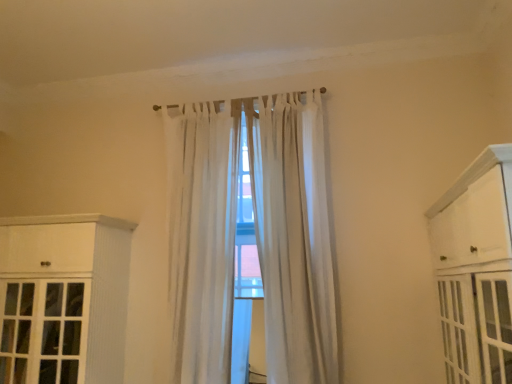
Question: From a real-world perspective, is white sheer curtain at center, which ranks as the 2th curtain in right-to-left order, physically above white sheer curtain at center, placed as the second curtain when sorted from left to right?

Choices:
 (A) yes
 (B) no

Answer: (B)

Question: Are white sheer curtain at center, which ranks as the 2th curtain in right-to-left order, and white sheer curtain at center, placed as the second curtain when sorted from left to right, beside each other?

Choices:
 (A) no
 (B) yes

Answer: (A)

Question: From the image's perspective, is white sheer curtain at center, the 1th curtain when ordered from left to right, above white sheer curtain at center, placed as the second curtain when sorted from left to right?

Choices:
 (A) yes
 (B) no

Answer: (B)

Question: Does white sheer curtain at center, which ranks as the 2th curtain in right-to-left order, have a smaller size compared to white sheer curtain at center, placed as the second curtain when sorted from left to right?

Choices:
 (A) yes
 (B) no

Answer: (B)

Question: Can you confirm if white sheer curtain at center, the 1th curtain when ordered from left to right, is bigger than white sheer curtain at center, placed as the second curtain when sorted from left to right?

Choices:
 (A) yes
 (B) no

Answer: (A)

Question: Is white sheer curtain at center, placed as the first curtain when sorted from right to left, situated inside white sheer curtain at center, the 1th curtain when ordered from left to right, or outside?

Choices:
 (A) outside
 (B) inside

Answer: (A)

Question: Based on their sizes in the image, would you say white sheer curtain at center, placed as the first curtain when sorted from right to left, is bigger or smaller than white sheer curtain at center, the 1th curtain when ordered from left to right?

Choices:
 (A) small
 (B) big

Answer: (A)

Question: From a real-world perspective, is white sheer curtain at center, placed as the first curtain when sorted from right to left, physically located above or below white sheer curtain at center, the 1th curtain when ordered from left to right?

Choices:
 (A) below
 (B) above

Answer: (B)

Question: Considering the positions of point (279, 306) and point (168, 248), is point (279, 306) closer or farther from the camera than point (168, 248)?

Choices:
 (A) closer
 (B) farther

Answer: (A)

Question: Considering the relative positions of white wood cabinet at left, which ranks as the first cabinetry in back-to-front order, and white sheer curtain at center, placed as the first curtain when sorted from right to left, in the image provided, is white wood cabinet at left, which ranks as the first cabinetry in back-to-front order, to the left or to the right of white sheer curtain at center, placed as the first curtain when sorted from right to left,?

Choices:
 (A) left
 (B) right

Answer: (A)

Question: Is white wood cabinet at left, which appears as the 2th cabinetry when viewed from the right, spatially inside white sheer curtain at center, placed as the second curtain when sorted from left to right, or outside of it?

Choices:
 (A) inside
 (B) outside

Answer: (B)

Question: In terms of size, does white wood cabinet at left, which ranks as the first cabinetry in back-to-front order, appear bigger or smaller than white sheer curtain at center, placed as the first curtain when sorted from right to left?

Choices:
 (A) big
 (B) small

Answer: (A)

Question: In terms of height, does white wood cabinet at left, which ranks as the first cabinetry in back-to-front order, look taller or shorter compared to white sheer curtain at center, placed as the first curtain when sorted from right to left?

Choices:
 (A) short
 (B) tall

Answer: (A)

Question: In terms of height, does white sheer curtain at center, the 1th curtain when ordered from left to right, look taller or shorter compared to white wood cabinet at left, which appears as the 2th cabinetry when viewed from the right?

Choices:
 (A) short
 (B) tall

Answer: (B)

Question: From a real-world perspective, is white sheer curtain at center, the 1th curtain when ordered from left to right, positioned above or below white wood cabinet at left, which is counted as the 2th cabinetry, starting from the front?

Choices:
 (A) above
 (B) below

Answer: (A)